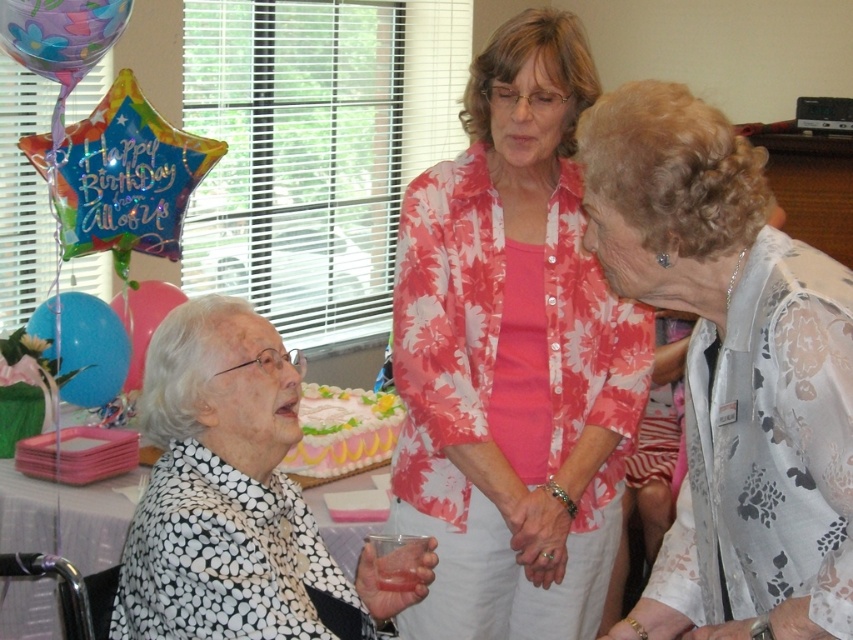
Question: Estimate the real-world distances between objects in this image. Which object is farther from the white frosted cake at center?

Choices:
 (A) floral-patterned balloon at upper left
 (B) pink floral blouse at center
 (C) blue glossy balloon at lower left
 (D) translucent pink balloon at lower left

Answer: (A)

Question: Which point is closer to the camera?

Choices:
 (A) floral-patterned balloon at upper left
 (B) black dotted scarf at lower left

Answer: (B)

Question: Does white frosted cake at center lie behind blue glossy balloon at lower left?

Choices:
 (A) no
 (B) yes

Answer: (A)

Question: Observing the image, what is the correct spatial positioning of white frosted cake at center in reference to blue glossy balloon at lower left?

Choices:
 (A) left
 (B) right

Answer: (B)

Question: Can you confirm if black dotted scarf at lower left is positioned to the right of white frosted cake at center?

Choices:
 (A) no
 (B) yes

Answer: (A)

Question: Which point is closer to the camera?

Choices:
 (A) (51, 310)
 (B) (245, 577)
 (C) (57, 29)

Answer: (B)